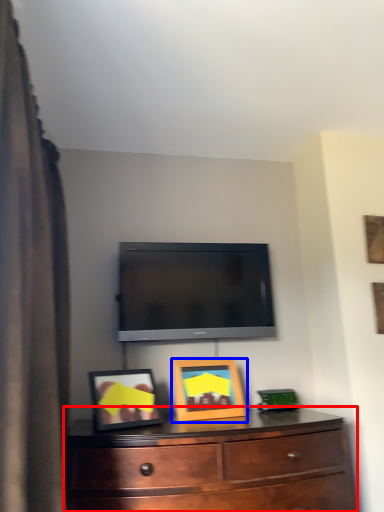
Question: Which of the following is the closest to the observer, chest of drawers (highlighted by a red box) or picture frame (highlighted by a blue box)?

Choices:
 (A) chest of drawers
 (B) picture frame

Answer: (A)